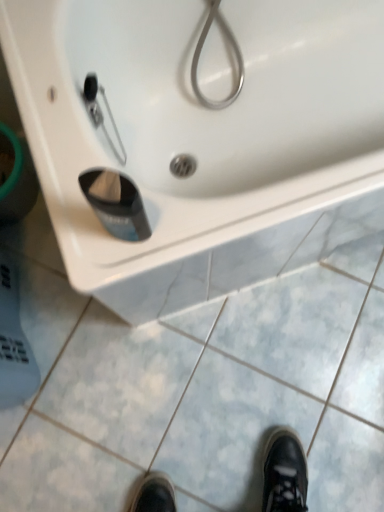
Question: Can you confirm if black plastic cup at lower center is bigger than white glossy sink at upper center?

Choices:
 (A) yes
 (B) no

Answer: (B)

Question: Can you confirm if black plastic cup at lower center is positioned to the right of white glossy sink at upper center?

Choices:
 (A) no
 (B) yes

Answer: (A)

Question: Can you confirm if black plastic cup at lower center is positioned to the left of white glossy sink at upper center?

Choices:
 (A) yes
 (B) no

Answer: (A)

Question: Considering the relative sizes of black plastic cup at lower center and white glossy sink at upper center in the image provided, is black plastic cup at lower center thinner than white glossy sink at upper center?

Choices:
 (A) no
 (B) yes

Answer: (B)

Question: Is black plastic cup at lower center not near white glossy sink at upper center?

Choices:
 (A) no
 (B) yes

Answer: (A)

Question: Considering their positions, is white glossy sink at upper center located in front of or behind white glossy sink at upper center?

Choices:
 (A) front
 (B) behind

Answer: (A)

Question: In terms of size, does white glossy sink at upper center appear bigger or smaller than white glossy sink at upper center?

Choices:
 (A) small
 (B) big

Answer: (B)

Question: Considering the positions of white glossy sink at upper center and white glossy sink at upper center in the image, is white glossy sink at upper center taller or shorter than white glossy sink at upper center?

Choices:
 (A) short
 (B) tall

Answer: (B)

Question: Is white glossy sink at upper center situated inside white glossy sink at upper center or outside?

Choices:
 (A) outside
 (B) inside

Answer: (A)

Question: Based on their sizes in the image, would you say white glossy sink at upper center is bigger or smaller than black plastic cup at lower center?

Choices:
 (A) small
 (B) big

Answer: (B)

Question: Is point (44, 219) closer or farther from the camera than point (129, 184)?

Choices:
 (A) closer
 (B) farther

Answer: (B)

Question: Relative to black plastic cup at lower center, is white glossy sink at upper center in front or behind?

Choices:
 (A) front
 (B) behind

Answer: (B)

Question: Looking at their shapes, would you say white glossy sink at upper center is wider or thinner than black plastic cup at lower center?

Choices:
 (A) thin
 (B) wide

Answer: (B)

Question: From a real-world perspective, is black plastic cup at lower center positioned above or below white glossy sink at upper center?

Choices:
 (A) below
 (B) above

Answer: (B)

Question: Looking at their shapes, would you say black plastic cup at lower center is wider or thinner than white glossy sink at upper center?

Choices:
 (A) thin
 (B) wide

Answer: (A)